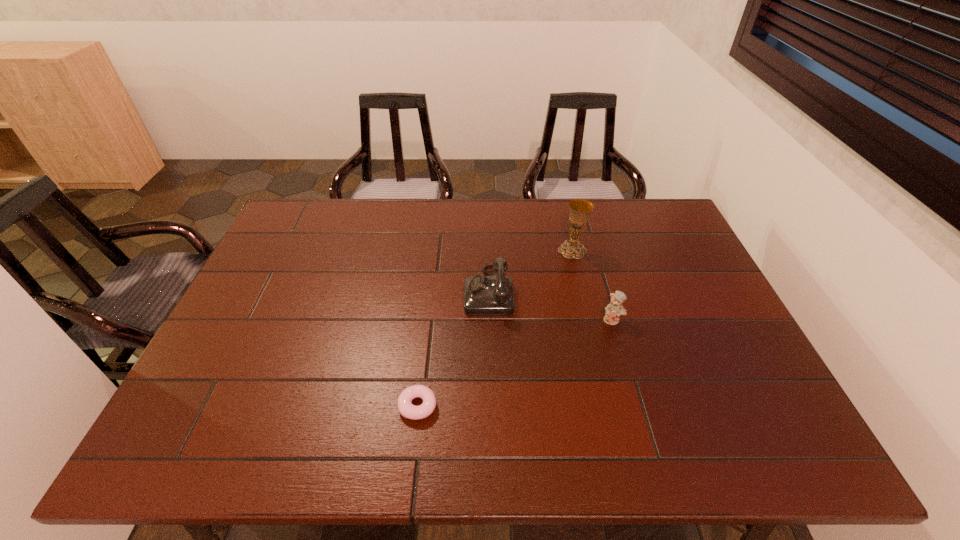
The image size is (960, 540). In order to click on free spot between the second object from left to right and the chalice in this screenshot , I will do `click(530, 271)`.

The width and height of the screenshot is (960, 540). I want to click on free space that is in between the teddy bear and the leftmost object, so click(516, 363).

The height and width of the screenshot is (540, 960). I want to click on free space between the second object from left to right and the tallest object, so click(x=530, y=271).

Locate an element on the screen. The width and height of the screenshot is (960, 540). free point between the shortest object and the telephone is located at coordinates click(453, 348).

Where is `free space between the teddy bear and the doughnut`? Image resolution: width=960 pixels, height=540 pixels. free space between the teddy bear and the doughnut is located at coordinates (516, 363).

Where is `vacant point located between the tallest object and the shortest object`? vacant point located between the tallest object and the shortest object is located at coordinates (495, 328).

At what (x,y) coordinates should I click in order to perform the action: click on blank region between the teddy bear and the telephone. Please return your answer as a coordinate pair (x, y). The image size is (960, 540). Looking at the image, I should click on (550, 305).

Where is `free space between the tallest object and the doughnut`? The width and height of the screenshot is (960, 540). free space between the tallest object and the doughnut is located at coordinates (495, 328).

At what (x,y) coordinates should I click in order to perform the action: click on vacant space that's between the second object from left to right and the chalice. Please return your answer as a coordinate pair (x, y). Looking at the image, I should click on (530, 271).

The image size is (960, 540). I want to click on object that stands as the second closest to the telephone, so click(405, 407).